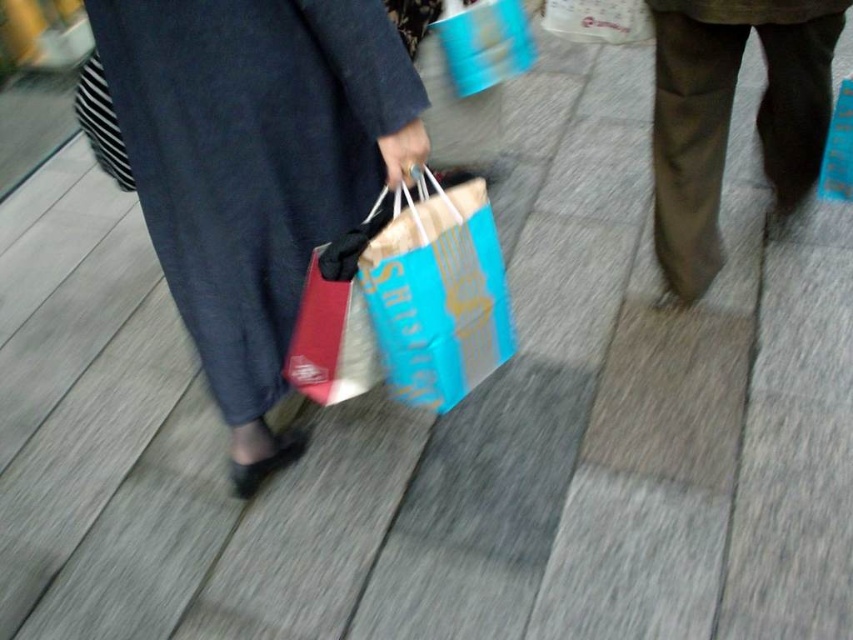
Question: Can you confirm if matte fabric dress at center is thinner than dark brown pants at right?

Choices:
 (A) no
 (B) yes

Answer: (A)

Question: Which of these objects is positioned closest to the blue paper bag at center?

Choices:
 (A) matte fabric dress at center
 (B) dark brown pants at right

Answer: (A)

Question: Which point is farther from the camera taking this photo?

Choices:
 (A) (767, 115)
 (B) (450, 307)

Answer: (A)

Question: Does matte fabric dress at center have a lesser width compared to dark brown pants at right?

Choices:
 (A) yes
 (B) no

Answer: (B)

Question: Which point is farther from the camera taking this photo?

Choices:
 (A) (381, 291)
 (B) (779, 108)
 (C) (323, 81)

Answer: (B)

Question: Considering the relative positions of matte fabric dress at center and dark brown pants at right in the image provided, where is matte fabric dress at center located with respect to dark brown pants at right?

Choices:
 (A) right
 (B) left

Answer: (B)